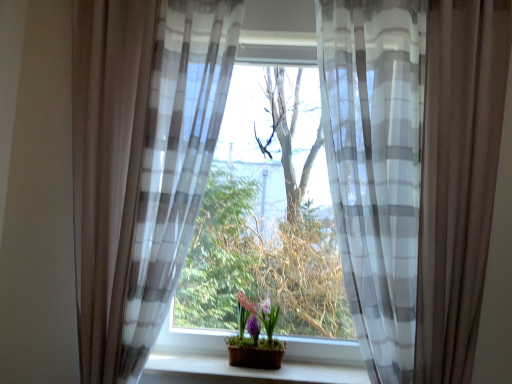
Identify the location of vacant area that lies to the right of matte purple pot at center. This screenshot has height=384, width=512. (301, 372).